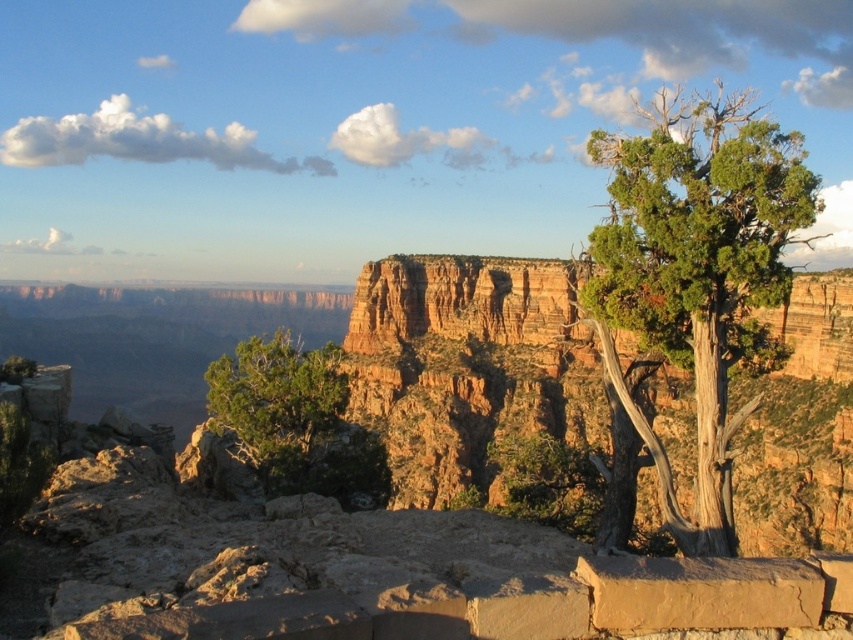
Question: Is green textured tree at upper right above green rough textured bush at lower left?

Choices:
 (A) no
 (B) yes

Answer: (B)

Question: Among these objects, which one is nearest to the camera?

Choices:
 (A) green textured tree at upper right
 (B) green rough textured bush at lower left

Answer: (A)

Question: Considering the relative positions of green textured tree at upper right and green rough textured bush at lower left in the image provided, where is green textured tree at upper right located with respect to green rough textured bush at lower left?

Choices:
 (A) above
 (B) below

Answer: (A)

Question: Does green textured tree at upper right have a smaller size compared to green rough textured bush at lower left?

Choices:
 (A) no
 (B) yes

Answer: (A)